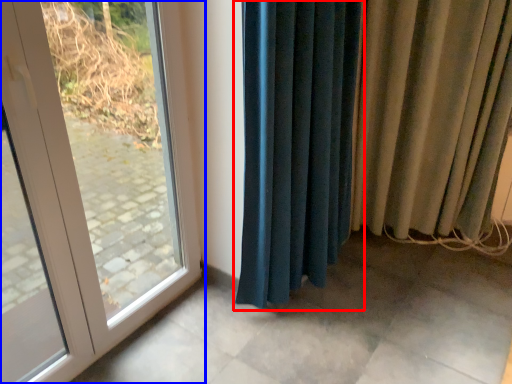
Question: Which of the following is the closest to the observer, curtain (highlighted by a red box) or door (highlighted by a blue box)?

Choices:
 (A) curtain
 (B) door

Answer: (B)